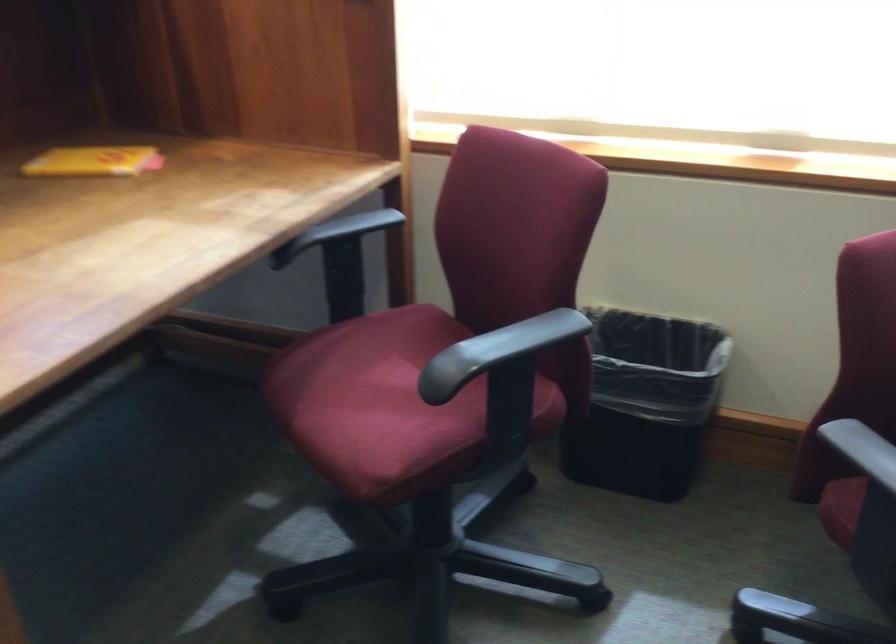
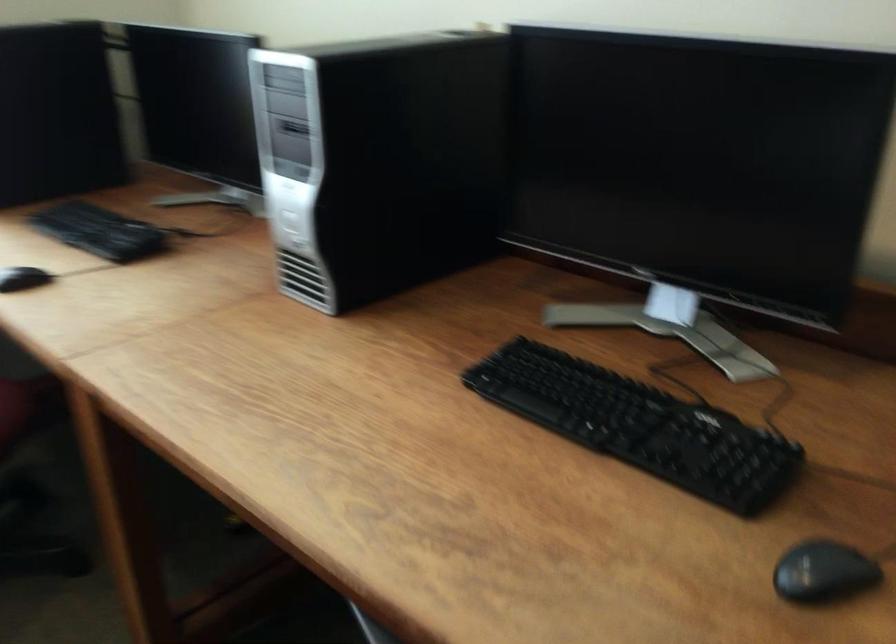
Question: The camera is either moving clockwise (left) or counter-clockwise (right) around the object. The first image is from the beginning of the video and the second image is from the end. Is the camera moving left or right when shooting the video?

Choices:
 (A) Left
 (B) Right

Answer: (A)